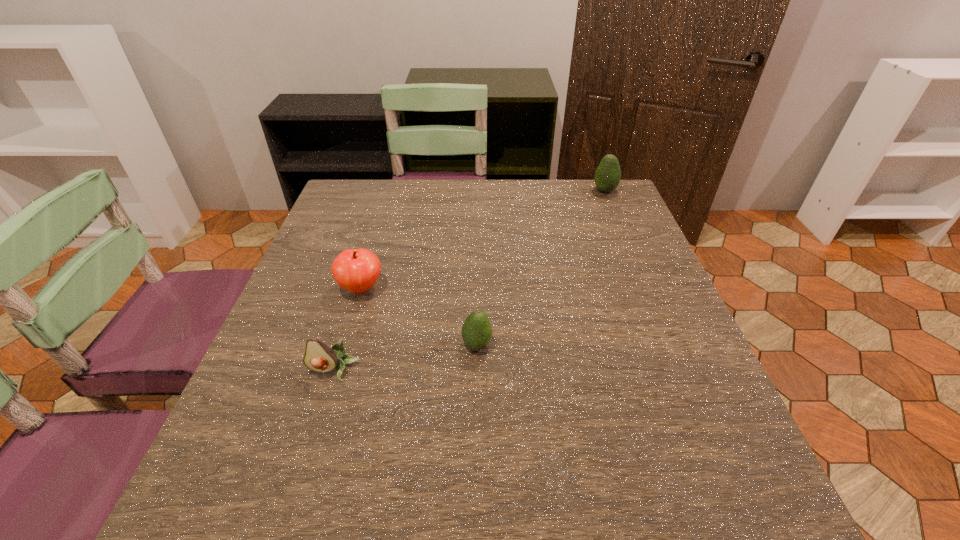
In the image, there is a desktop. Where is `vacant region at the far left corner`? vacant region at the far left corner is located at coordinates (339, 198).

Find the location of a particular element. Image resolution: width=960 pixels, height=540 pixels. vacant space at the far right corner of the desktop is located at coordinates (626, 216).

In order to click on empty space between the farthest object and the second farthest object in this screenshot , I will do `click(483, 240)`.

The image size is (960, 540). In order to click on free area in between the nearest object and the third object from left to right in this screenshot , I will do `click(405, 358)`.

The width and height of the screenshot is (960, 540). I want to click on vacant area that lies between the second farthest object and the leftmost avocado, so click(x=348, y=330).

Where is `free space between the rightmost avocado and the nearest object`? This screenshot has width=960, height=540. free space between the rightmost avocado and the nearest object is located at coordinates (469, 281).

I want to click on unoccupied position between the apple and the farthest avocado, so click(x=483, y=240).

In order to click on free space between the apple and the leftmost avocado in this screenshot , I will do `click(348, 330)`.

Identify the location of free space between the apple and the second farthest avocado. The width and height of the screenshot is (960, 540). [419, 316].

I want to click on vacant area between the third nearest object and the leftmost avocado, so click(348, 330).